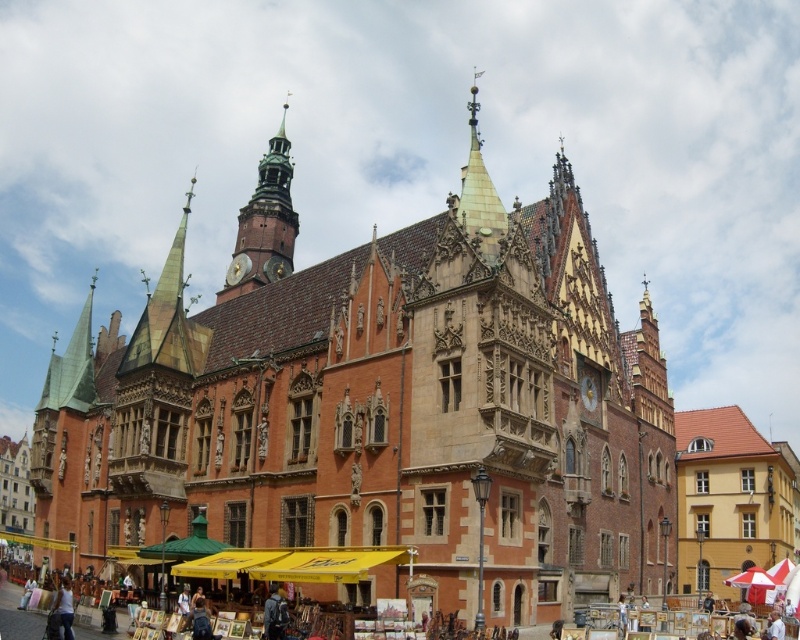
Is point (406, 556) closer to camera compared to point (70, 593)?

No, (406, 556) is behind (70, 593).

Is yellow fabric canopy at lower center positioned at the back of white cotton shirt at lower left?

Yes, yellow fabric canopy at lower center is further from the viewer.

Between point (382, 554) and point (66, 620), which one is positioned in front?

Point (66, 620) is in front.

The width and height of the screenshot is (800, 640). Identify the location of yellow fabric canopy at lower center. (296, 563).

Can you confirm if polished wood clock tower at upper center is wider than white cotton shirt at lower left?

Yes.

Is point (284, 164) positioned in front of point (64, 618)?

That is False.

In order to click on polished wood clock tower at upper center in this screenshot , I will do `click(264, 225)`.

The width and height of the screenshot is (800, 640). What do you see at coordinates (381, 404) in the screenshot? I see `matte brick church at center` at bounding box center [381, 404].

This screenshot has width=800, height=640. I want to click on matte brick church at center, so click(x=381, y=404).